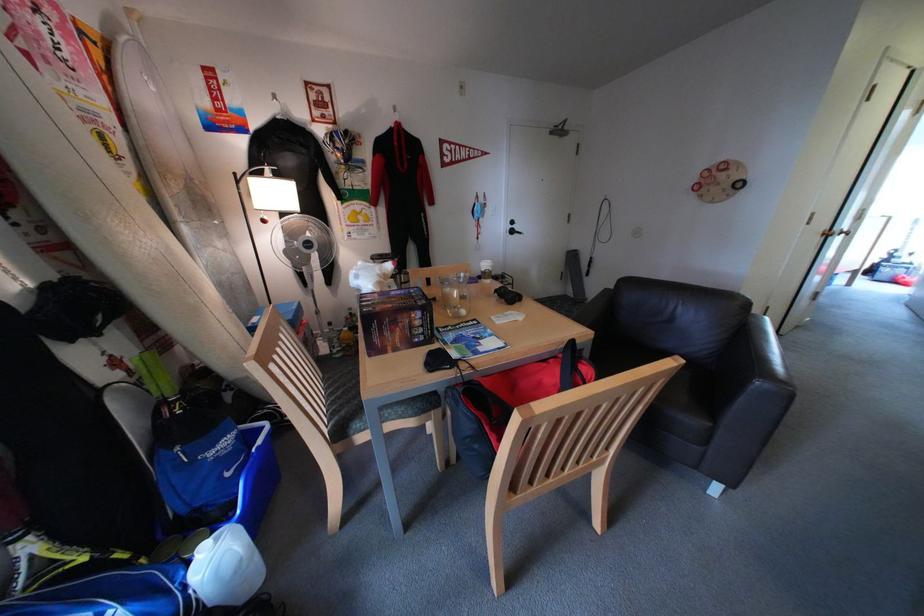
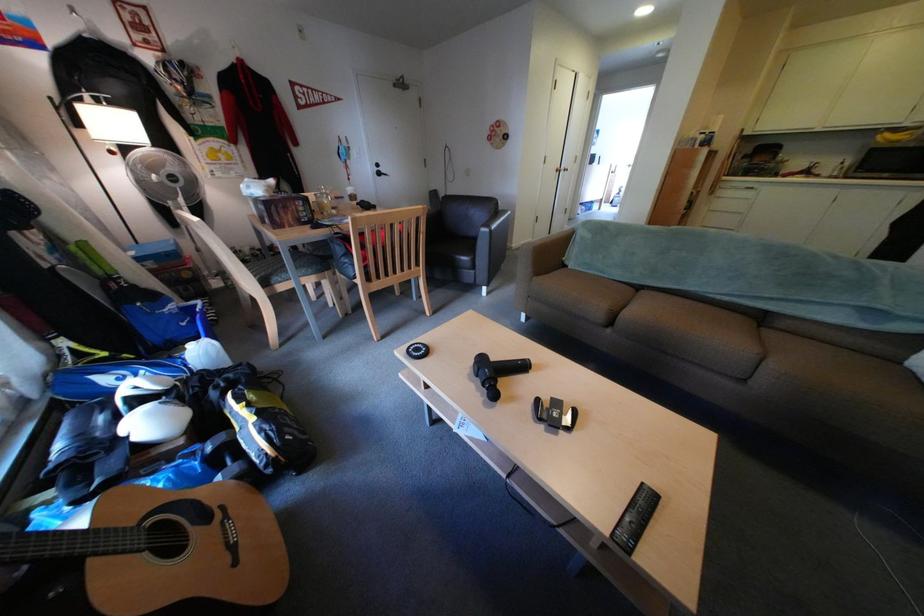
In the second image, find the point that corresponds to (723,493) in the first image.

(496, 296)